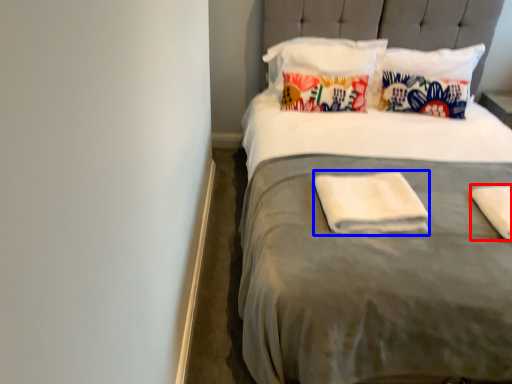
Question: Among these objects, which one is nearest to the camera, material (highlighted by a red box) or material (highlighted by a blue box)?

Choices:
 (A) material
 (B) material

Answer: (A)